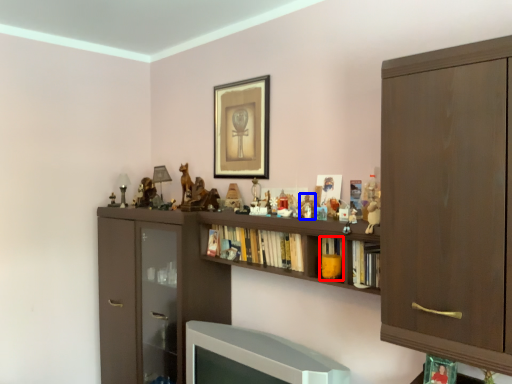
Question: Which point is closer to the camera, book (highlighted by a red box) or toy (highlighted by a blue box)?

Choices:
 (A) book
 (B) toy

Answer: (A)